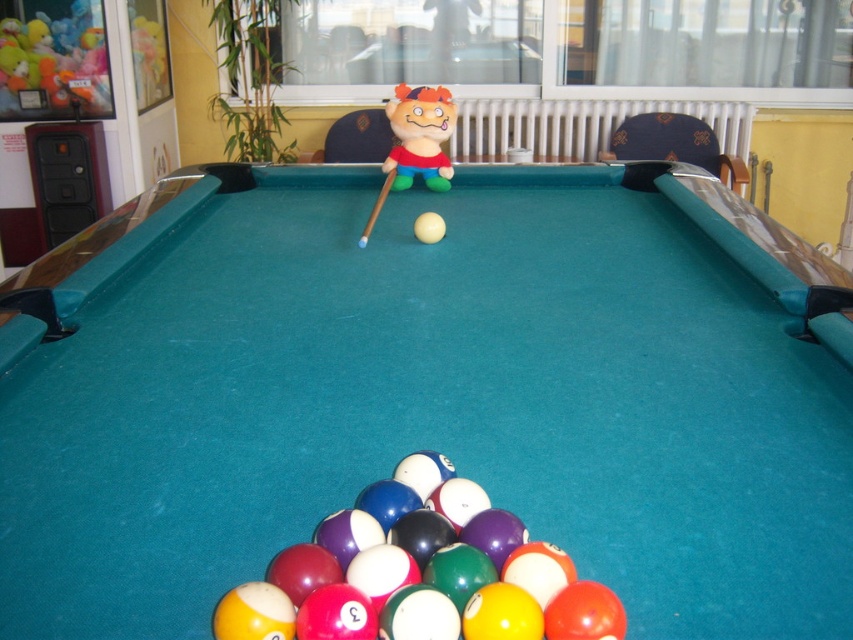
You are standing at the edge of the pool table and notice a specific point marked at coordinates (x=428, y=392). What object is located at that exact point?

The teal felt billiard table at center is located at point (x=428, y=392).

You are standing at the point with coordinates (419, 134). Looking towards the pool table, can you see the plush toy at center?

Yes, the plush toy at center is located at point (419, 134), so you are standing right where the plush toy is placed. Therefore, you would be standing on top of it and wouldn

You are setting up a game of pool and need to place a 1.2 meter wide rectangular tablecloth on the teal felt billiard table at center and the wooden at center. Which table should you place it on to ensure it fits properly?

The teal felt billiard table at center is wider than the wooden at center, so the tablecloth should be placed on the teal felt billiard table at center to ensure it fits properly.